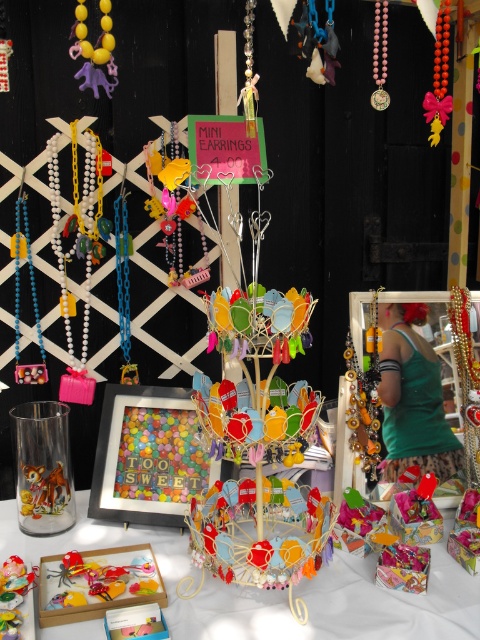
Question: Can you confirm if matte plastic jewelry at center is smaller than matte yellow plastic elephant at upper left?

Choices:
 (A) yes
 (B) no

Answer: (B)

Question: Is the position of matte plastic jewelry at center more distant than that of matte yellow plastic elephant at upper left?

Choices:
 (A) no
 (B) yes

Answer: (A)

Question: Which point is closer to the camera?

Choices:
 (A) matte plastic jewelry at center
 (B) matte yellow plastic elephant at upper left

Answer: (A)

Question: Among these points, which one is nearest to the camera?

Choices:
 (A) (248, 627)
 (B) (110, 56)

Answer: (A)

Question: Is matte plastic jewelry at center wider than matte yellow plastic elephant at upper left?

Choices:
 (A) no
 (B) yes

Answer: (B)